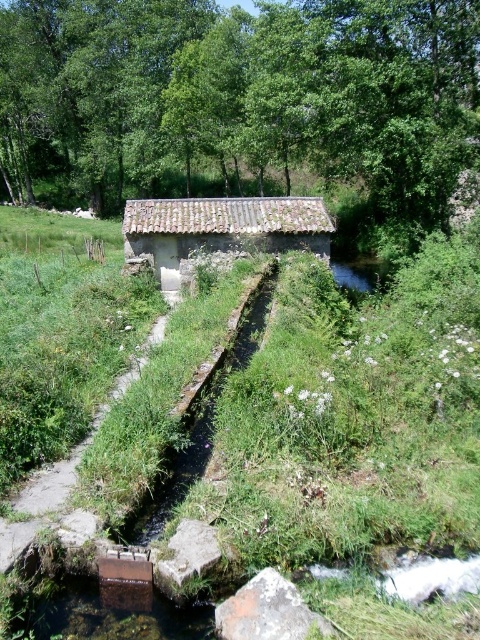
Which is below, rusty metal hut at center or brown concrete trench at center?

brown concrete trench at center

Who is positioned more to the right, rusty metal hut at center or brown concrete trench at center?

From the viewer's perspective, brown concrete trench at center appears more on the right side.

Is point (253, 209) less distant than point (192, 477)?

No, it is behind (192, 477).

This screenshot has height=640, width=480. In order to click on rusty metal hut at center in this screenshot , I will do `click(220, 228)`.